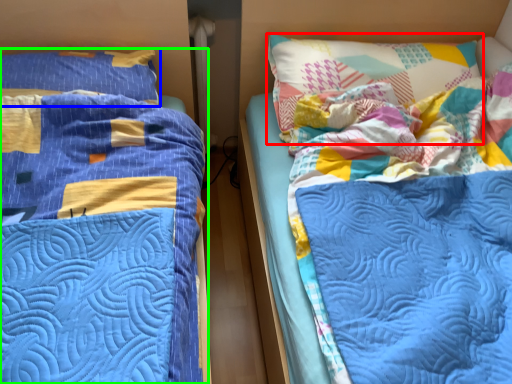
Question: Estimate the real-world distances between objects in this image. Which object is farther from pillow (highlighted by a red box), pillow (highlighted by a blue box) or bed (highlighted by a green box)?

Choices:
 (A) pillow
 (B) bed

Answer: (A)